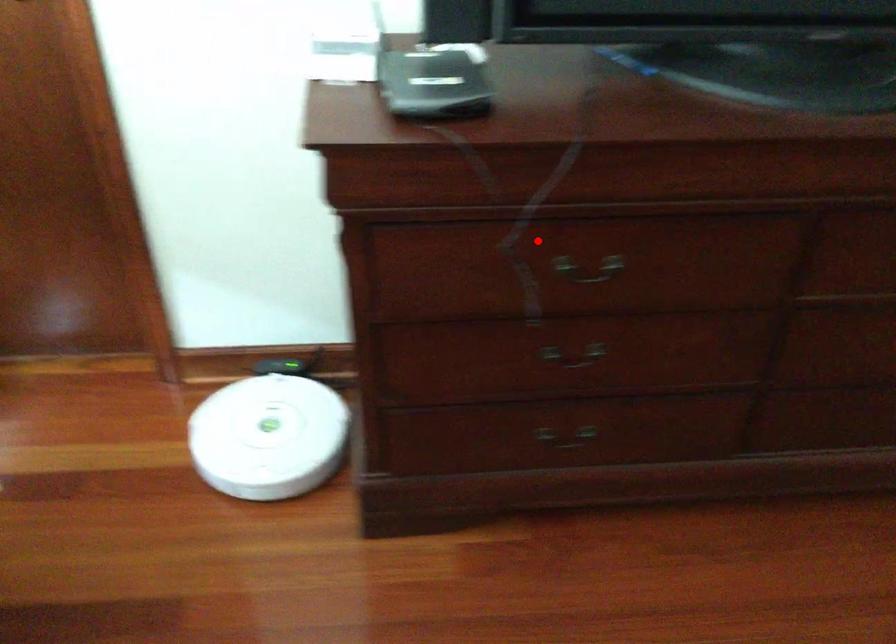
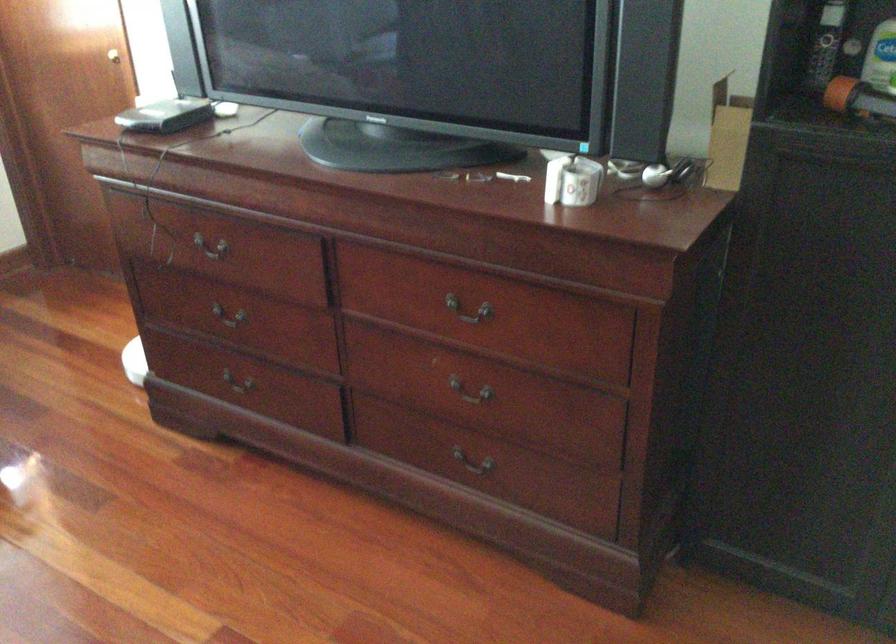
The point at the highlighted location is marked in the first image. Where is the corresponding point in the second image?

(211, 241)